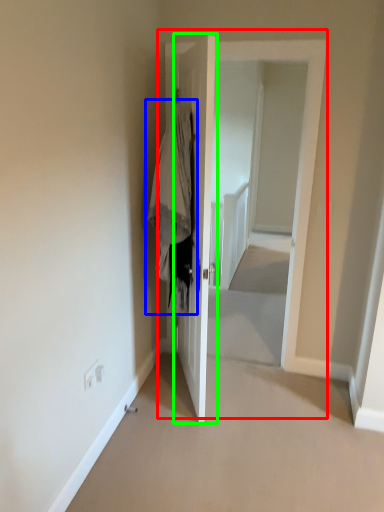
Question: Based on their relative distances, which object is nearer to door (highlighted by a red box)? Choose from clothing (highlighted by a blue box) and door (highlighted by a green box).

Choices:
 (A) clothing
 (B) door

Answer: (B)